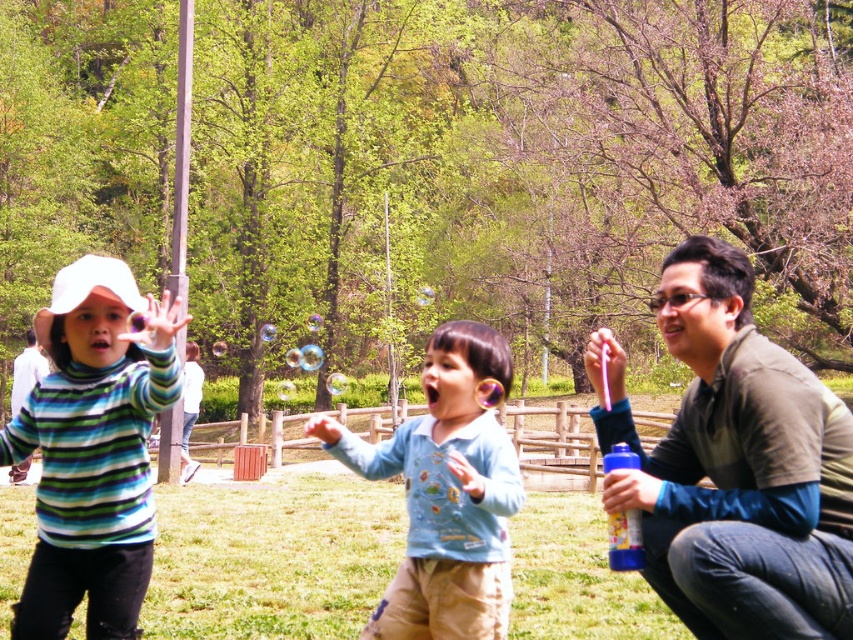
Consider the image. Does matte brown shirt at lower right lie in front of white matte hat at left?

No, it is not.

Is point (701, 550) positioned behind point (15, 420)?

No.

Where is `matte brown shirt at lower right`? The image size is (853, 640). matte brown shirt at lower right is located at coordinates (735, 465).

Who is taller, matte brown shirt at lower right or blue cotton shirt at center?

Standing taller between the two is matte brown shirt at lower right.

Does matte brown shirt at lower right appear on the left side of blue cotton shirt at center?

No, matte brown shirt at lower right is not to the left of blue cotton shirt at center.

Who is more forward, (x=750, y=317) or (x=447, y=538)?

Point (x=750, y=317) is more forward.

What are the coordinates of `matte brown shirt at lower right` in the screenshot? It's located at (735, 465).

Can you confirm if matte brown shirt at lower right is positioned to the left of green grass at center?

Incorrect, matte brown shirt at lower right is not on the left side of green grass at center.

The width and height of the screenshot is (853, 640). What do you see at coordinates (735, 465) in the screenshot?
I see `matte brown shirt at lower right` at bounding box center [735, 465].

Measure the distance between point (750, 321) and camera.

Point (750, 321) and camera are 3.68 meters apart from each other.

What are the coordinates of `matte brown shirt at lower right` in the screenshot? It's located at (735, 465).